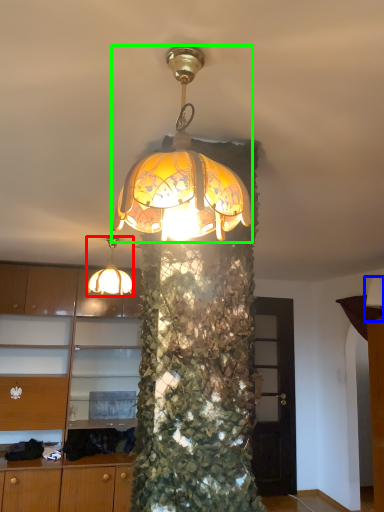
Question: Which is nearer to the lamp (highlighted by a red box)? lamp (highlighted by a blue box) or lamp (highlighted by a green box).

Choices:
 (A) lamp
 (B) lamp

Answer: (B)